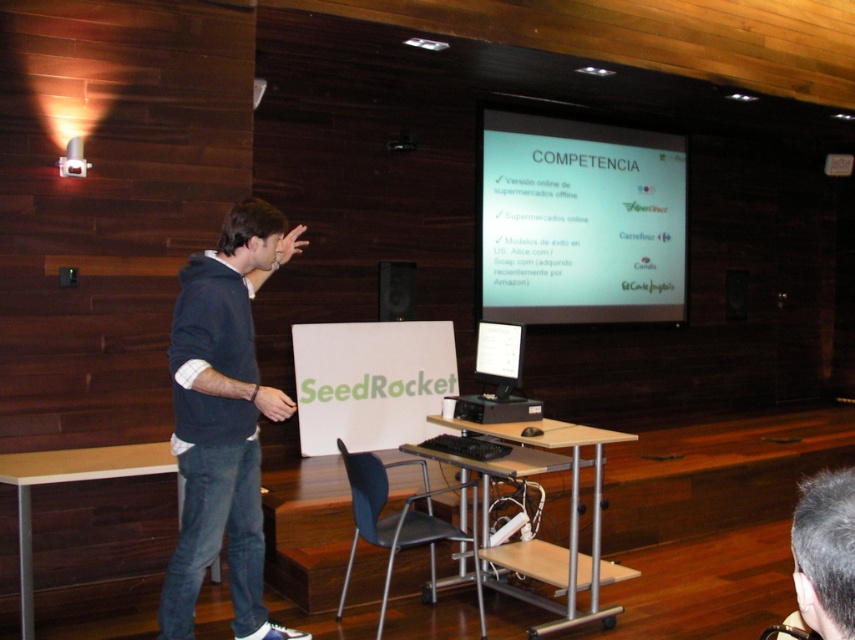
You are a photographer positioned at the back of the room. You notice two points on the screen during a presentation. The first point is labeled as point (x=519, y=179) and the second as point (x=225, y=440). Which point appears closer to your camera lens?

Point (x=225, y=440) is closer to the camera lens because it is positioned nearer than point (x=519, y=179), which is further away.

You are an event organizer setting up a presentation room. You need to place a 3ft wide laptop on the desk between the white matte projector screen at upper center and the matte black speaker at upper center. Can the laptop fit between them?

The white matte projector screen at upper center is wider than the matte black speaker at upper center. Since the laptop is 3ft wide, it depends on the combined space between them. However, the description only states the screen is wider, not the distance between them. Without knowing the exact spacing, we can only confirm the screen is wider, but cannot determine if the laptop will fit.